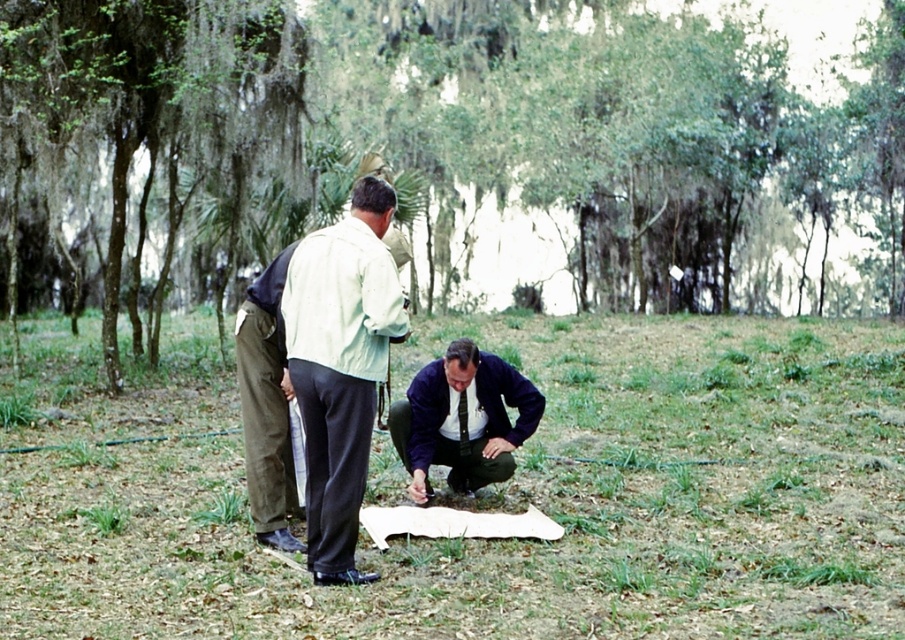
Which is below, green grass at center or khaki cotton pants at center?

khaki cotton pants at center is below.

Where is `green grass at center`? This screenshot has height=640, width=905. green grass at center is located at coordinates (489, 492).

The width and height of the screenshot is (905, 640). What do you see at coordinates (449, 152) in the screenshot?
I see `green mossy tree at center` at bounding box center [449, 152].

The width and height of the screenshot is (905, 640). What do you see at coordinates (449, 152) in the screenshot?
I see `green mossy tree at center` at bounding box center [449, 152].

Identify the location of green mossy tree at center. (449, 152).

Is dark blue fabric at lower center positioned in front of khaki cotton pants at center?

That is False.

Who is higher up, dark blue fabric at lower center or khaki cotton pants at center?

khaki cotton pants at center is higher up.

Between point (487, 355) and point (277, 378), which one is positioned behind?

The point (487, 355) is behind.

Where is `dark blue fabric at lower center`? The image size is (905, 640). dark blue fabric at lower center is located at coordinates (462, 419).